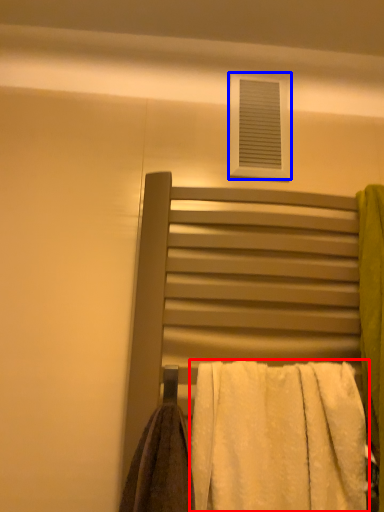
Question: Which object is further to the camera taking this photo, towel (highlighted by a red box) or window (highlighted by a blue box)?

Choices:
 (A) towel
 (B) window

Answer: (B)